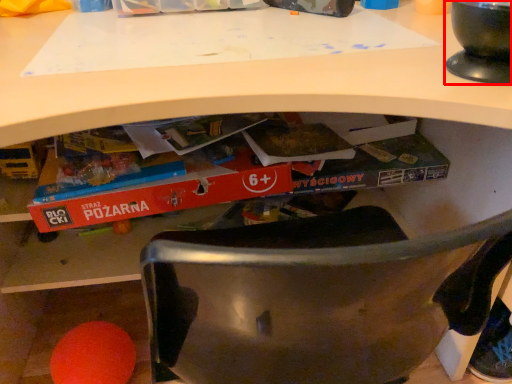
Question: From the image's perspective, where is appliance (annotated by the red box) located in relation to paperback book in the image?

Choices:
 (A) above
 (B) below

Answer: (A)